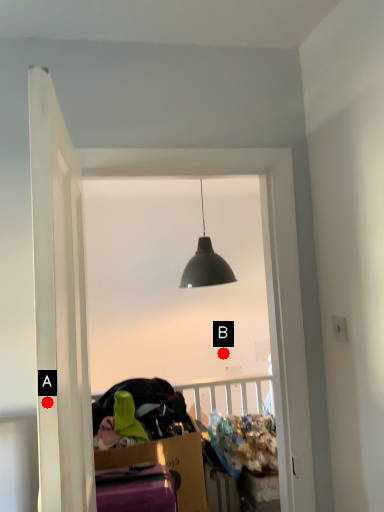
Question: Two points are circled on the image, labeled by A and B beside each circle. Which point appears farthest from the camera in this image?

Choices:
 (A) A is further
 (B) B is further

Answer: (B)